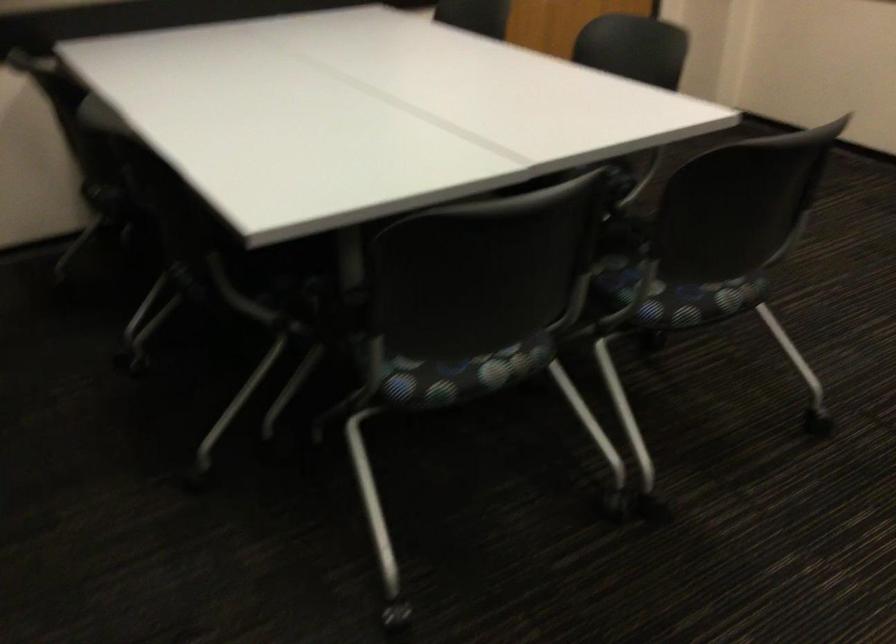
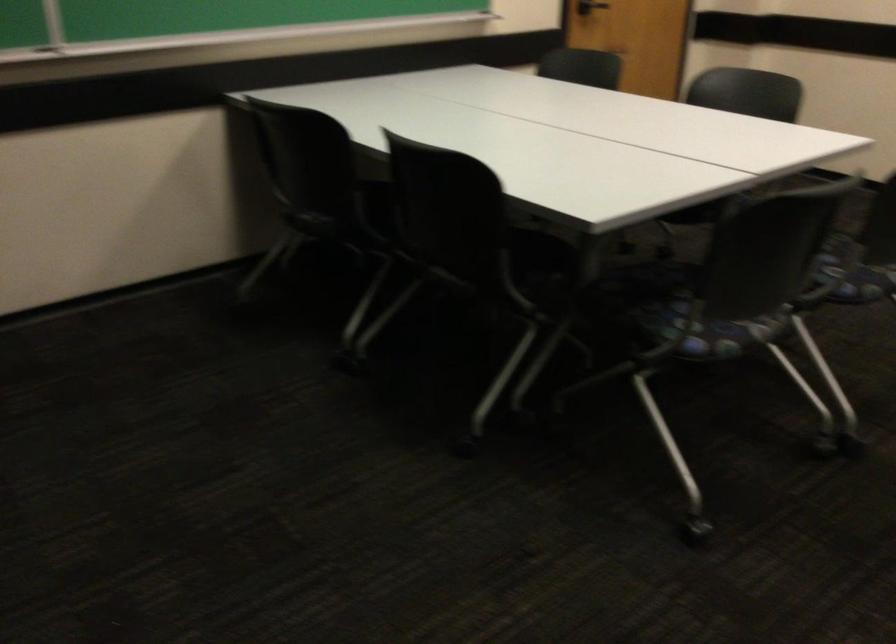
Where in the second image is the point corresponding to [188,236] from the first image?

(455, 245)